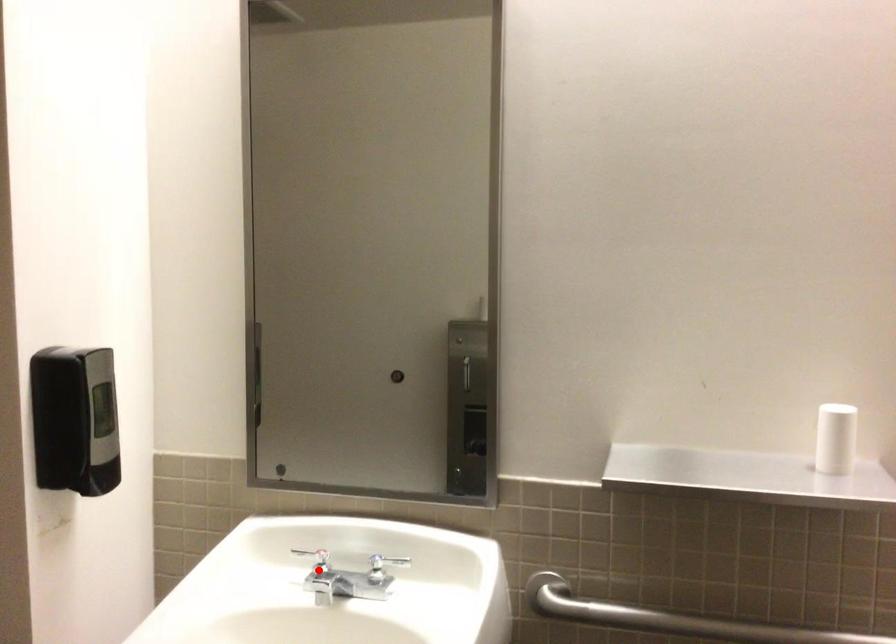
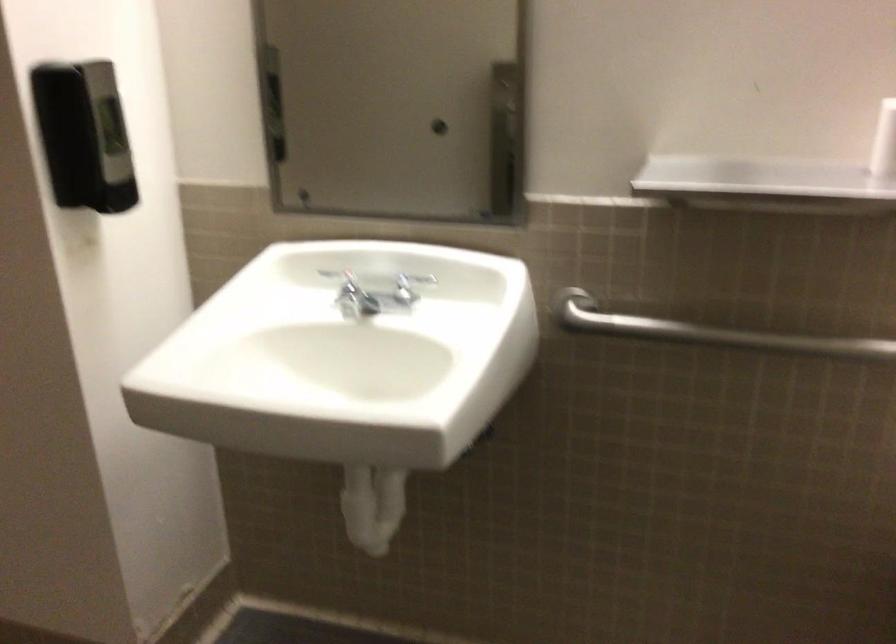
Where in the second image is the point corresponding to the highlighted location from the first image?

(346, 290)